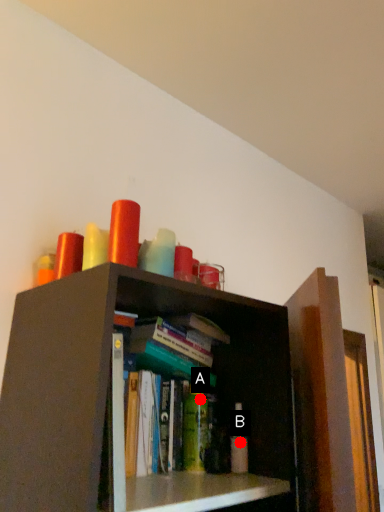
Question: Two points are circled on the image, labeled by A and B beside each circle. Which of the following is the farthest from the observer?

Choices:
 (A) A is further
 (B) B is further

Answer: (A)